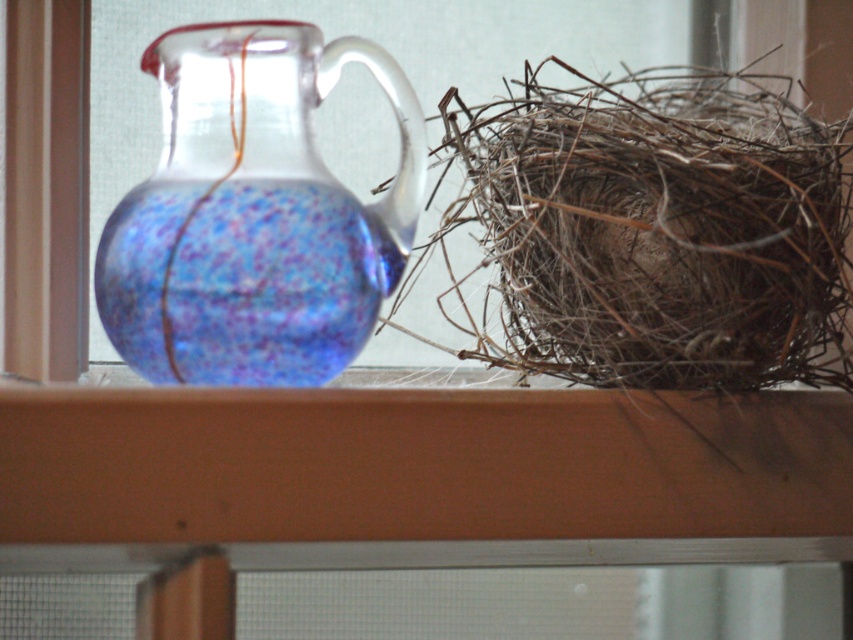
You are standing in front of a windowsill with a glass pitcher and a bird nest. There are two points marked on the scene. The first point is at coordinate (776, 364) and the second is at (196, 301). Which point is closer to you?

Point (196, 301) is closer to you because the description states that point (776, 364) is further to the camera than point (196, 301).

You are organizing a display on a shelf and need to stack items from tallest to shortest. You have the brown twigs nest at right and the matte glass jug at left. Which should go first in the stack?

The brown twigs nest at right should be placed first in the stack since it has a greater height than the matte glass jug at left.

Based on the photo, you are arranging items on a windowsill and need to know which object occupies more space. Which is larger between the brown twigs nest at right and the matte glass jug at left?

The brown twigs nest at right is bigger than the matte glass jug at left, so it occupies more space.